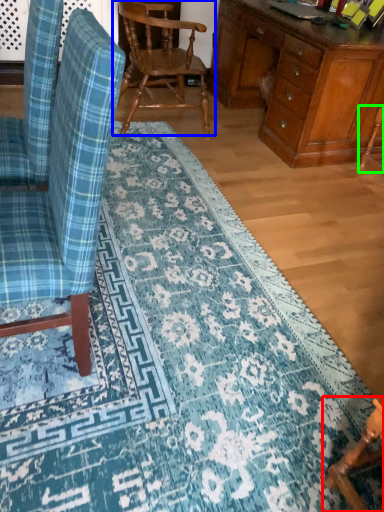
Question: Which object is positioned farthest from chair (highlighted by a red box)? Select from chair (highlighted by a blue box) and armchair (highlighted by a green box).

Choices:
 (A) chair
 (B) armchair

Answer: (A)